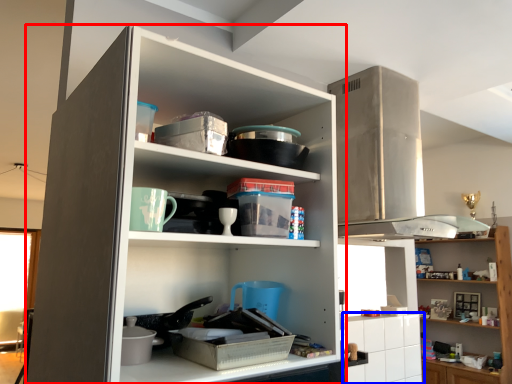
Question: Which object appears closest to the camera in this image, cupboard (highlighted by a red box) or cabinetry (highlighted by a blue box)?

Choices:
 (A) cupboard
 (B) cabinetry

Answer: (A)